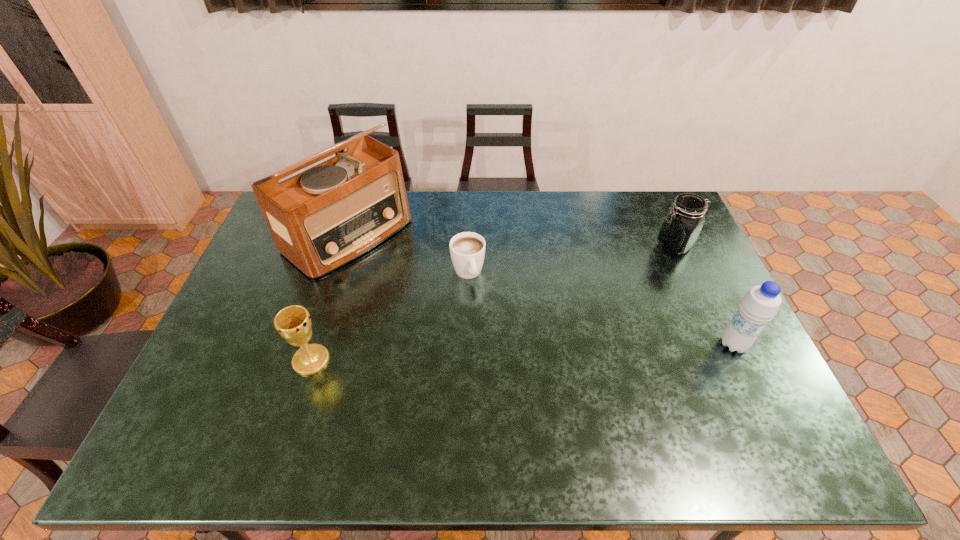
Identify the location of vacant area that satisfies the following two spatial constraints: 1. on the front side of the radio receiver; 2. on the left side of the fourth shortest object. This screenshot has width=960, height=540. (313, 344).